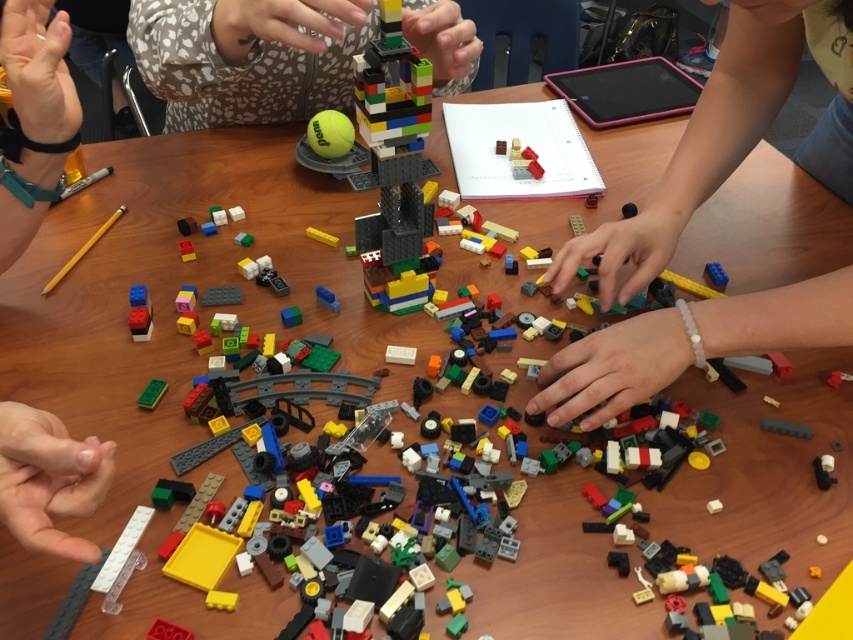
Is multicolored plastic lego tower at center taller than green matte brick at center?

Indeed, multicolored plastic lego tower at center has a greater height compared to green matte brick at center.

Between point (165, 13) and point (152, 390), which one is positioned behind?

The point (165, 13) is more distant.

Between point (289, 70) and point (165, 388), which one is positioned behind?

The point (289, 70) is behind.

Image resolution: width=853 pixels, height=640 pixels. I want to click on multicolored plastic lego tower at center, so click(x=248, y=58).

Can you confirm if green rubber tennis ball at center is positioned below green matte brick at center?

Incorrect, green rubber tennis ball at center is not positioned below green matte brick at center.

How distant is green rubber tennis ball at center from green matte brick at center?

They are 16.13 inches apart.

Describe the element at coordinates (329, 132) in the screenshot. I see `green rubber tennis ball at center` at that location.

The image size is (853, 640). I want to click on green rubber tennis ball at center, so click(329, 132).

Can you confirm if smooth plastic hand at lower left is positioned to the right of green matte brick at center?

Indeed, smooth plastic hand at lower left is positioned on the right side of green matte brick at center.

The width and height of the screenshot is (853, 640). What do you see at coordinates (48, 480) in the screenshot?
I see `smooth plastic hand at lower left` at bounding box center [48, 480].

Is point (3, 497) closer to camera compared to point (144, 387)?

Yes, point (3, 497) is closer to viewer.

At what (x,y) coordinates should I click in order to perform the action: click on smooth plastic hand at lower left. Please return your answer as a coordinate pair (x, y). Looking at the image, I should click on point(48,480).